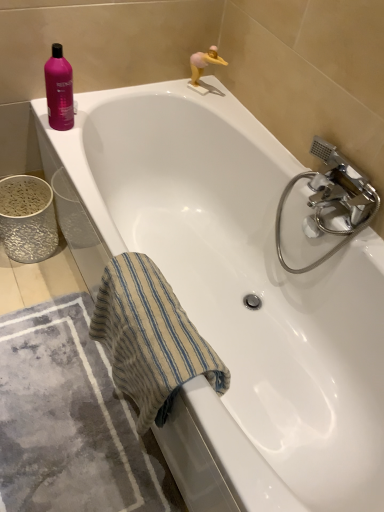
At what (x,y) coordinates should I click in order to perform the action: click on vacant location below gray textured bath mat at lower left (from a real-world perspective). Please return your answer as a coordinate pair (x, y). The width and height of the screenshot is (384, 512). Looking at the image, I should click on (73, 444).